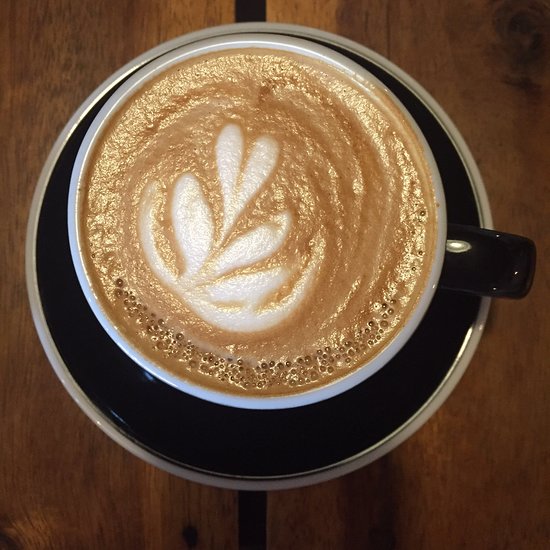
Where is `brown table`? brown table is located at coordinates (89, 37).